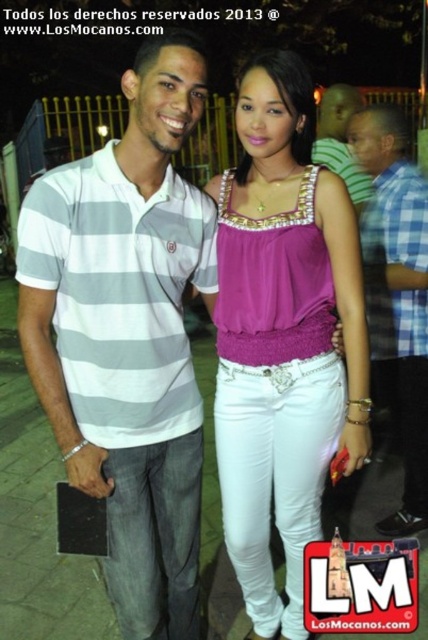
You are a photographer trying to capture both the gray striped polo shirt at left and the gray striped shirt at center in a single frame. Which shirt should you focus on first to ensure both are in the frame?

The gray striped polo shirt at left is smaller than the gray striped shirt at center, so you should focus on the gray striped shirt at center first to ensure both are in the frame.

You are a photographer trying to adjust the focus of your camera. You have two points to focus on in the image, point (302, 413) and point (347, 122). Which point should you focus on first if you want to start with the one that is closer to the camera?

Point (302, 413) is closer to the viewer than point (347, 122), so you should focus on point (302, 413) first.

You are a photographer adjusting the focus on your camera. You have two points to focus on in the scene, point 1 at coordinates point (x=110, y=216) and point 2 at coordinates point (x=232, y=326). Which point should you focus on to capture the subject that is closer to the camera?

Point (x=110, y=216) is closer to the viewer than point (x=232, y=326), so you should focus on point (x=110, y=216) to capture the subject that is closer to the camera.